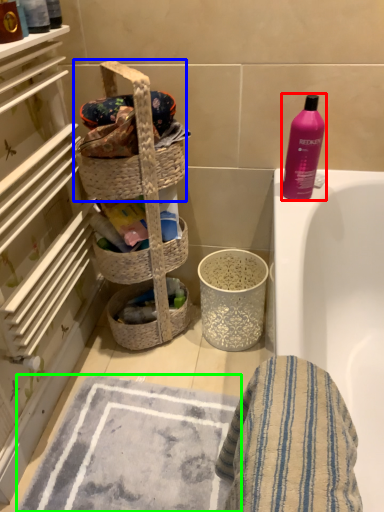
Question: Estimate the real-world distances between objects in this image. Which object is farther from bottle (highlighted by a red box), picnic basket (highlighted by a blue box) or bath mat (highlighted by a green box)?

Choices:
 (A) picnic basket
 (B) bath mat

Answer: (B)